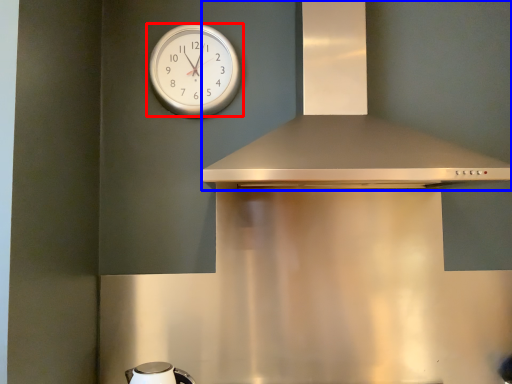
Question: Which object appears farthest to the camera in this image, wall clock (highlighted by a red box) or vent (highlighted by a blue box)?

Choices:
 (A) wall clock
 (B) vent

Answer: (A)